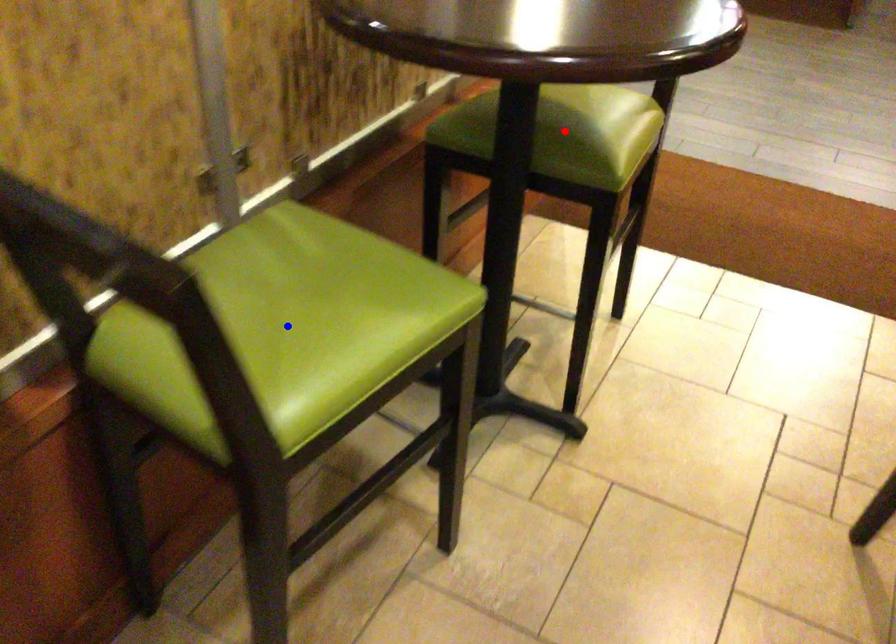
Question: Two points are marked on the image. Which point is closer to the camera?

Choices:
 (A) Blue point is closer.
 (B) Red point is closer.

Answer: (A)